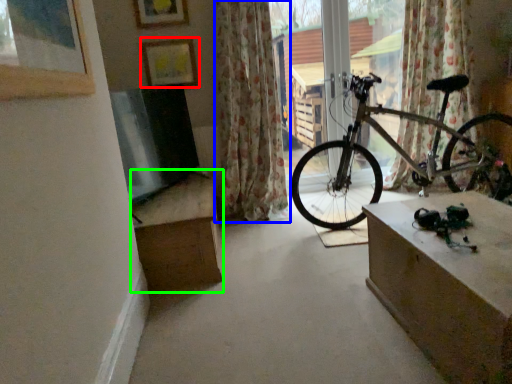
Question: Estimate the real-world distances between objects in this image. Which object is farther from picture frame (highlighted by a red box), curtain (highlighted by a blue box) or cardboard box (highlighted by a green box)?

Choices:
 (A) curtain
 (B) cardboard box

Answer: (B)